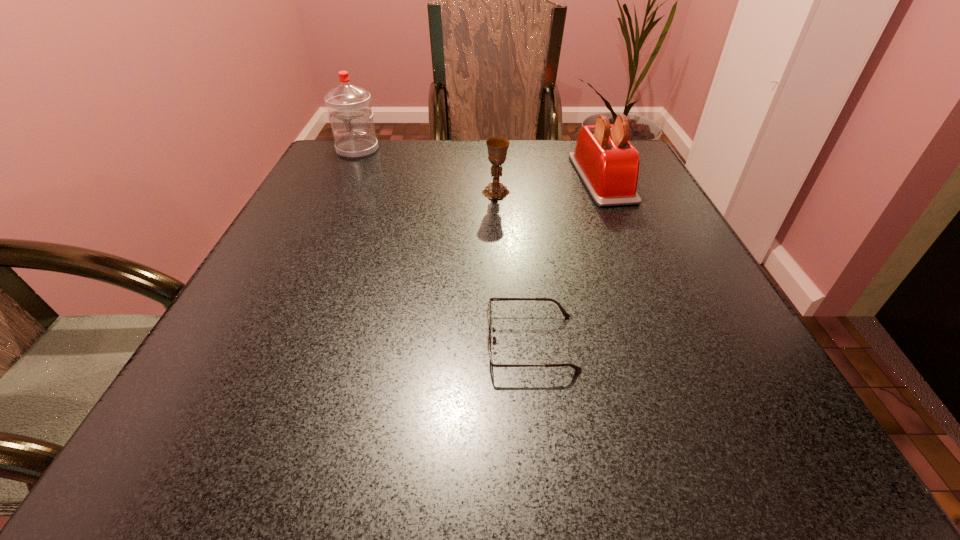
Locate an element on the screen. The width and height of the screenshot is (960, 540). vacant space at the near edge of the desktop is located at coordinates (422, 477).

Identify the location of free region at the left edge of the desktop. This screenshot has width=960, height=540. (210, 360).

The height and width of the screenshot is (540, 960). What are the coordinates of `free space at the right edge of the desktop` in the screenshot? It's located at (636, 281).

What are the coordinates of `free space between the nearest object and the third tallest object` in the screenshot? It's located at (514, 267).

This screenshot has width=960, height=540. In order to click on free space between the third shortest object and the chalice in this screenshot , I will do `click(549, 185)`.

Find the location of a particular element. Image resolution: width=960 pixels, height=540 pixels. vacant space that's between the toaster and the spectacles is located at coordinates (566, 260).

The image size is (960, 540). Find the location of `empty space between the toaster and the tallest object`. empty space between the toaster and the tallest object is located at coordinates (480, 164).

The width and height of the screenshot is (960, 540). I want to click on free space between the second tallest object and the chalice, so click(x=549, y=185).

In order to click on empty location between the toaster and the water bottle in this screenshot , I will do `click(480, 164)`.

Locate an element on the screen. The image size is (960, 540). free area in between the tallest object and the spectacles is located at coordinates (444, 246).